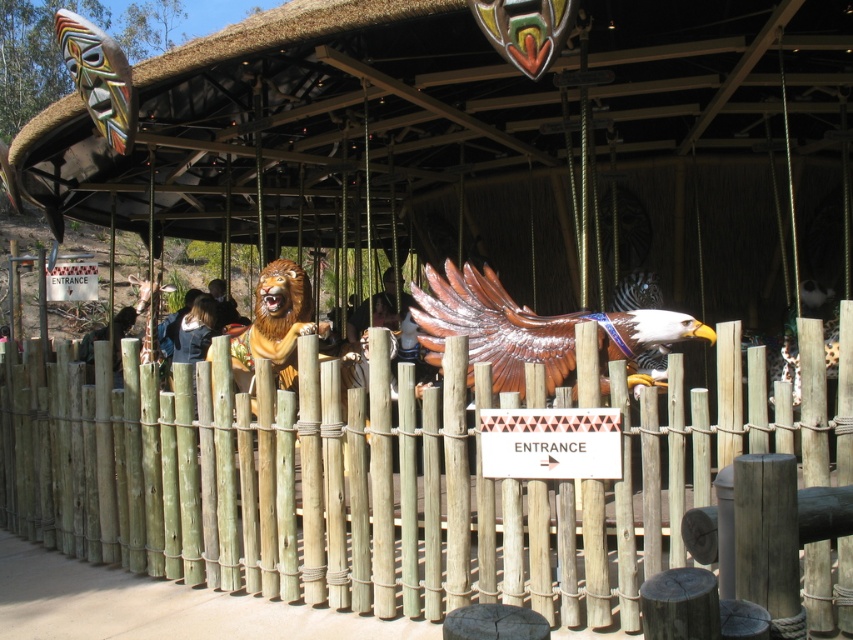
You are standing in front of the amusement park ride and notice the green bamboo fence at center and the smooth brown hair at center. Which object is closer to the ground?

The green bamboo fence at center is located below smooth brown hair at center, so it is closer to the ground.

You are standing at the entrance of the amusement park ride and see the point marked at coordinates (532, 328). What object is located at this point?

The point marked at coordinates (532, 328) marks the brown wooden eagle at center.